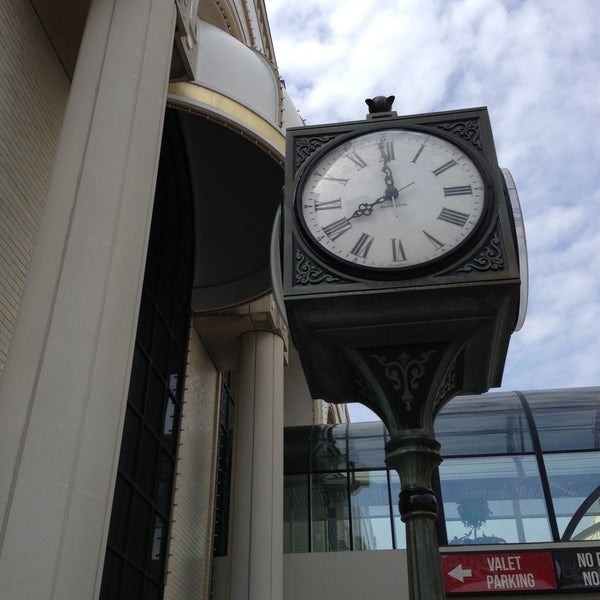
At what (x,y) coordinates should I click in order to perform the action: click on iron. Please return your answer as a coordinate pair (x, y). This screenshot has height=600, width=600. Looking at the image, I should click on (307, 292).